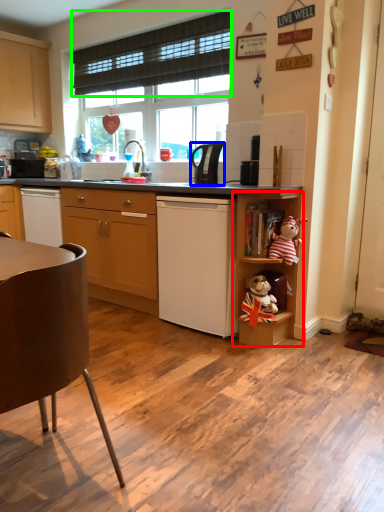
Question: Estimate the real-world distances between objects in this image. Which object is farther from shelf (highlighted by a red box), kitchen appliance (highlighted by a blue box) or curtain (highlighted by a green box)?

Choices:
 (A) kitchen appliance
 (B) curtain

Answer: (B)